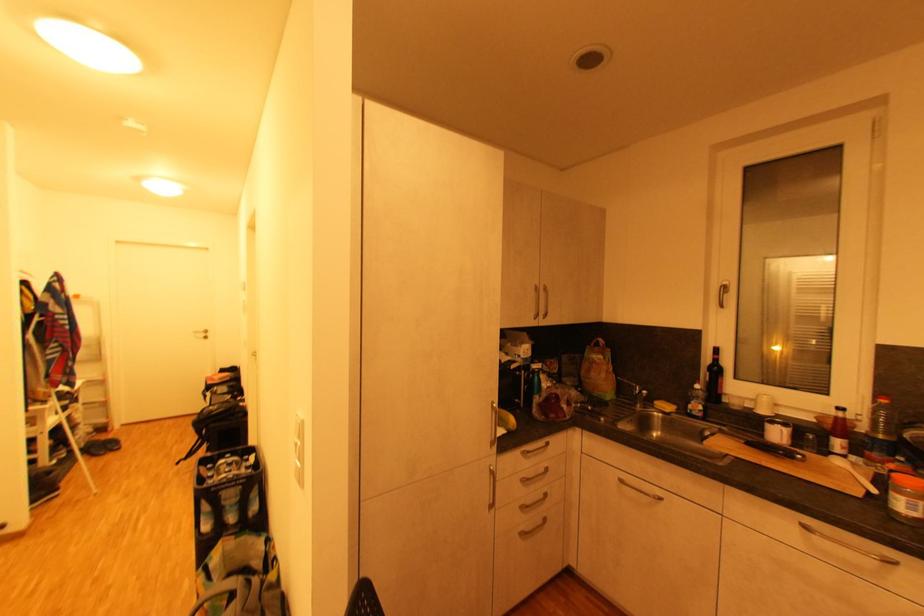
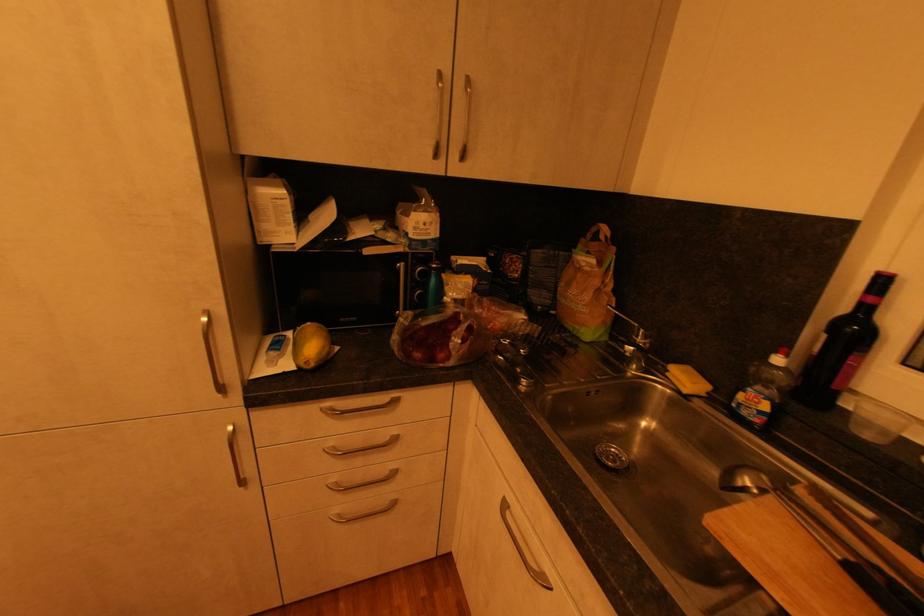
Locate, in the second image, the point that corresponds to (x=626, y=483) in the first image.

(508, 507)